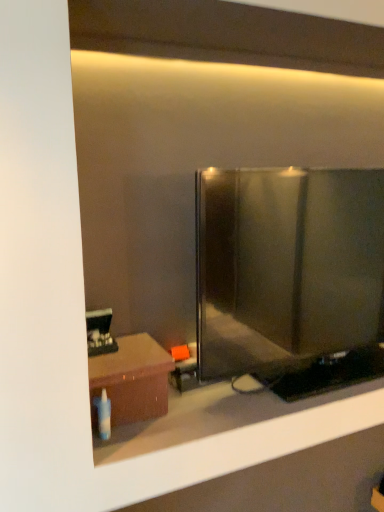
Question: Can we say brown matte table at lower left lies outside matte black glass door at center?

Choices:
 (A) yes
 (B) no

Answer: (A)

Question: From a real-world perspective, is brown matte table at lower left physically above matte black glass door at center?

Choices:
 (A) yes
 (B) no

Answer: (B)

Question: Considering the relative sizes of brown matte table at lower left and matte black glass door at center in the image provided, is brown matte table at lower left bigger than matte black glass door at center?

Choices:
 (A) no
 (B) yes

Answer: (A)

Question: Is matte black glass door at center located within brown matte table at lower left?

Choices:
 (A) yes
 (B) no

Answer: (B)

Question: Does brown matte table at lower left have a greater height compared to matte black glass door at center?

Choices:
 (A) yes
 (B) no

Answer: (B)

Question: Is brown matte table at lower left to the right of matte black glass door at center from the viewer's perspective?

Choices:
 (A) no
 (B) yes

Answer: (A)

Question: Is the depth of matte black glass door at center greater than that of brown matte table at lower left?

Choices:
 (A) no
 (B) yes

Answer: (A)

Question: Does matte black glass door at center appear on the right side of brown matte table at lower left?

Choices:
 (A) no
 (B) yes

Answer: (B)

Question: Is matte black glass door at center taller than brown matte table at lower left?

Choices:
 (A) yes
 (B) no

Answer: (A)

Question: From the image's perspective, is matte black glass door at center under brown matte table at lower left?

Choices:
 (A) no
 (B) yes

Answer: (A)

Question: Considering the relative positions of matte black glass door at center and brown matte table at lower left in the image provided, is matte black glass door at center to the left of brown matte table at lower left from the viewer's perspective?

Choices:
 (A) yes
 (B) no

Answer: (B)

Question: From a real-world perspective, is matte black glass door at center physically above brown matte table at lower left?

Choices:
 (A) no
 (B) yes

Answer: (B)

Question: From a real-world perspective, is brown matte table at lower left physically located above or below matte black glass door at center?

Choices:
 (A) above
 (B) below

Answer: (B)